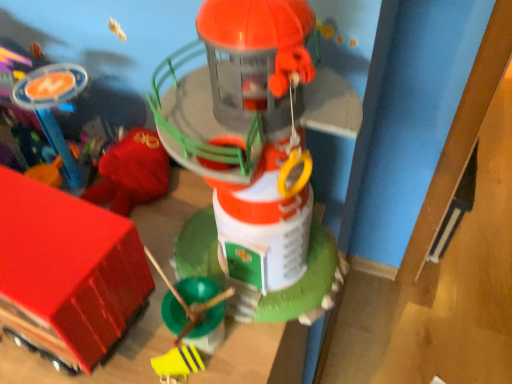
This screenshot has height=384, width=512. What do you see at coordinates (177, 364) in the screenshot?
I see `yellow matte toy at lower center, the second toy positioned from the right` at bounding box center [177, 364].

The height and width of the screenshot is (384, 512). What are the coordinates of `rubberized red truck at lower left, arranged as the first toy when viewed from the left` in the screenshot? It's located at (67, 271).

What do you see at coordinates (259, 153) in the screenshot? I see `smooth plastic toy at center, which is the 1th toy from right to left` at bounding box center [259, 153].

In order to click on yellow matte toy at lower center, marked as the second toy in a left-to-right arrangement in this screenshot , I will do `click(177, 364)`.

Does yellow matte toy at lower center, the second toy positioned from the right, have a greater height compared to smooth plastic toy at center, the third toy viewed from the left?

Incorrect, the height of yellow matte toy at lower center, the second toy positioned from the right, is not larger of that of smooth plastic toy at center, the third toy viewed from the left.

Is yellow matte toy at lower center, the second toy positioned from the right, not near smooth plastic toy at center, which is the 1th toy from right to left?

No, there isn't a large distance between yellow matte toy at lower center, the second toy positioned from the right, and smooth plastic toy at center, which is the 1th toy from right to left.

From a real-world perspective, is yellow matte toy at lower center, marked as the second toy in a left-to-right arrangement, positioned under smooth plastic toy at center, the third toy viewed from the left, based on gravity?

Yes, from a real-world perspective, yellow matte toy at lower center, marked as the second toy in a left-to-right arrangement, is below smooth plastic toy at center, the third toy viewed from the left.

How distant is smooth plastic toy at center, the third toy viewed from the left, from rubberized red truck at lower left, arranged as the first toy when viewed from the left?

smooth plastic toy at center, the third toy viewed from the left, is 6.60 inches away from rubberized red truck at lower left, arranged as the first toy when viewed from the left.

In terms of width, does smooth plastic toy at center, the third toy viewed from the left, look wider or thinner when compared to rubberized red truck at lower left, arranged as the first toy when viewed from the left?

In the image, smooth plastic toy at center, the third toy viewed from the left, appears to be more narrow than rubberized red truck at lower left, arranged as the first toy when viewed from the left.

How many degrees apart are the facing directions of smooth plastic toy at center, which is the 1th toy from right to left, and rubberized red truck at lower left, arranged as the third toy when viewed from the right?

There is a 8.5-degree angle between the facing directions of smooth plastic toy at center, which is the 1th toy from right to left, and rubberized red truck at lower left, arranged as the third toy when viewed from the right.

Find the location of a particular element. The width and height of the screenshot is (512, 384). toy above the rubberized red truck at lower left, arranged as the first toy when viewed from the left (from the image's perspective) is located at coordinates (259, 153).

Does rubberized red truck at lower left, arranged as the third toy when viewed from the right, appear on the left side of smooth plastic toy at center, which is the 1th toy from right to left?

Yes, rubberized red truck at lower left, arranged as the third toy when viewed from the right, is to the left of smooth plastic toy at center, which is the 1th toy from right to left.

Is rubberized red truck at lower left, arranged as the first toy when viewed from the left, positioned with its back to smooth plastic toy at center, which is the 1th toy from right to left?

No, smooth plastic toy at center, which is the 1th toy from right to left, is not at the back of rubberized red truck at lower left, arranged as the first toy when viewed from the left.

Is rubberized red truck at lower left, arranged as the first toy when viewed from the left, in contact with smooth plastic toy at center, which is the 1th toy from right to left?

Result: No, rubberized red truck at lower left, arranged as the first toy when viewed from the left, is not next to smooth plastic toy at center, which is the 1th toy from right to left.

Does rubberized red truck at lower left, arranged as the third toy when viewed from the right, lie in front of smooth plastic toy at center, which is the 1th toy from right to left?

No, rubberized red truck at lower left, arranged as the third toy when viewed from the right, is behind smooth plastic toy at center, which is the 1th toy from right to left.

Would you say yellow matte toy at lower center, the second toy positioned from the right, is to the left or to the right of rubberized red truck at lower left, arranged as the third toy when viewed from the right, in the picture?

yellow matte toy at lower center, the second toy positioned from the right, is to the right of rubberized red truck at lower left, arranged as the third toy when viewed from the right.

Which point is more forward, (161, 359) or (119, 260)?

Positioned in front is point (119, 260).

How different are the orientations of yellow matte toy at lower center, the second toy positioned from the right, and rubberized red truck at lower left, arranged as the third toy when viewed from the right, in degrees?

The angular difference between yellow matte toy at lower center, the second toy positioned from the right, and rubberized red truck at lower left, arranged as the third toy when viewed from the right, is 30.3 degrees.

Which object is thinner, yellow matte toy at lower center, the second toy positioned from the right, or rubberized red truck at lower left, arranged as the third toy when viewed from the right?

With smaller width is yellow matte toy at lower center, the second toy positioned from the right.

What's the angular difference between smooth plastic toy at center, which is the 1th toy from right to left, and yellow matte toy at lower center, marked as the second toy in a left-to-right arrangement,'s facing directions?

The angular difference between smooth plastic toy at center, which is the 1th toy from right to left, and yellow matte toy at lower center, marked as the second toy in a left-to-right arrangement, is 21.8 degrees.

Which is correct: smooth plastic toy at center, the third toy viewed from the left, is inside yellow matte toy at lower center, marked as the second toy in a left-to-right arrangement, or outside of it?

smooth plastic toy at center, the third toy viewed from the left, exists outside the volume of yellow matte toy at lower center, marked as the second toy in a left-to-right arrangement.

From the picture: Which is more to the right, smooth plastic toy at center, which is the 1th toy from right to left, or yellow matte toy at lower center, the second toy positioned from the right?

From the viewer's perspective, smooth plastic toy at center, which is the 1th toy from right to left, appears more on the right side.

Which is behind, smooth plastic toy at center, which is the 1th toy from right to left, or yellow matte toy at lower center, the second toy positioned from the right?

Positioned behind is yellow matte toy at lower center, the second toy positioned from the right.

Considering the sizes of objects rubberized red truck at lower left, arranged as the third toy when viewed from the right, and yellow matte toy at lower center, marked as the second toy in a left-to-right arrangement, in the image provided, who is taller, rubberized red truck at lower left, arranged as the third toy when viewed from the right, or yellow matte toy at lower center, marked as the second toy in a left-to-right arrangement,?

rubberized red truck at lower left, arranged as the third toy when viewed from the right, is taller.

Which of these two, rubberized red truck at lower left, arranged as the third toy when viewed from the right, or yellow matte toy at lower center, the second toy positioned from the right, is smaller?

With smaller size is yellow matte toy at lower center, the second toy positioned from the right.

Is rubberized red truck at lower left, arranged as the first toy when viewed from the left, aimed at yellow matte toy at lower center, marked as the second toy in a left-to-right arrangement?

No, rubberized red truck at lower left, arranged as the first toy when viewed from the left, is not aimed at yellow matte toy at lower center, marked as the second toy in a left-to-right arrangement.

This screenshot has width=512, height=384. I want to click on toy that is the 2nd one when counting forward from the yellow matte toy at lower center, marked as the second toy in a left-to-right arrangement, so click(x=259, y=153).

Find the location of a particular element. This screenshot has height=384, width=512. toy positioned vertically above the rubberized red truck at lower left, arranged as the first toy when viewed from the left (from a real-world perspective) is located at coordinates (259, 153).

Considering their positions, is smooth plastic toy at center, which is the 1th toy from right to left, positioned further to yellow matte toy at lower center, marked as the second toy in a left-to-right arrangement, than rubberized red truck at lower left, arranged as the third toy when viewed from the right?

Among the two, smooth plastic toy at center, which is the 1th toy from right to left, is located further to yellow matte toy at lower center, marked as the second toy in a left-to-right arrangement.

Estimate the real-world distances between objects in this image. Which object is further from rubberized red truck at lower left, arranged as the first toy when viewed from the left, smooth plastic toy at center, which is the 1th toy from right to left, or yellow matte toy at lower center, marked as the second toy in a left-to-right arrangement?

The object further to rubberized red truck at lower left, arranged as the first toy when viewed from the left, is smooth plastic toy at center, which is the 1th toy from right to left.

From the picture: Considering their positions, is yellow matte toy at lower center, marked as the second toy in a left-to-right arrangement, positioned further to rubberized red truck at lower left, arranged as the third toy when viewed from the right, than smooth plastic toy at center, the third toy viewed from the left?

Based on the image, smooth plastic toy at center, the third toy viewed from the left, appears to be further to rubberized red truck at lower left, arranged as the third toy when viewed from the right.

From the image, which object appears to be farther from smooth plastic toy at center, the third toy viewed from the left, yellow matte toy at lower center, the second toy positioned from the right, or rubberized red truck at lower left, arranged as the first toy when viewed from the left?

yellow matte toy at lower center, the second toy positioned from the right, is further to smooth plastic toy at center, the third toy viewed from the left.

Based on their spatial positions, is rubberized red truck at lower left, arranged as the third toy when viewed from the right, or smooth plastic toy at center, the third toy viewed from the left, further from yellow matte toy at lower center, marked as the second toy in a left-to-right arrangement?

smooth plastic toy at center, the third toy viewed from the left, lies further to yellow matte toy at lower center, marked as the second toy in a left-to-right arrangement, than the other object.

When comparing their distances from smooth plastic toy at center, the third toy viewed from the left, does rubberized red truck at lower left, arranged as the third toy when viewed from the right, or yellow matte toy at lower center, marked as the second toy in a left-to-right arrangement, seem closer?

rubberized red truck at lower left, arranged as the third toy when viewed from the right, is positioned closer to the anchor smooth plastic toy at center, the third toy viewed from the left.

Identify the location of toy between rubberized red truck at lower left, arranged as the third toy when viewed from the right, and smooth plastic toy at center, which is the 1th toy from right to left. This screenshot has height=384, width=512. (177, 364).